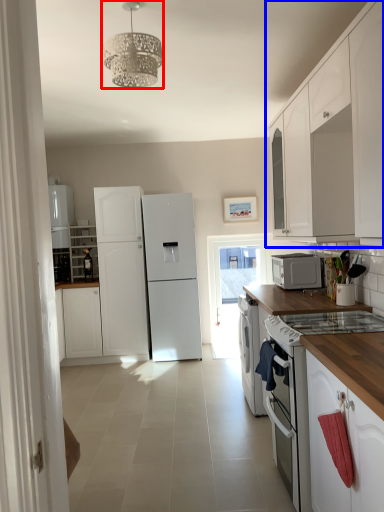
Question: Among these objects, which one is nearest to the camera, light fixture (highlighted by a red box) or cabinetry (highlighted by a blue box)?

Choices:
 (A) light fixture
 (B) cabinetry

Answer: (A)